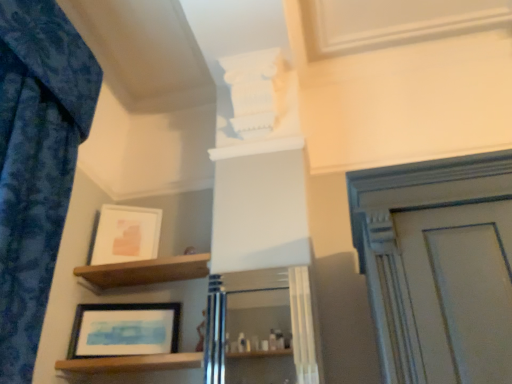
Question: Is blue fabric curtain at left bigger than matte white picture frame at upper left, which is the 1th picture frame in back-to-front order?

Choices:
 (A) yes
 (B) no

Answer: (A)

Question: Can you confirm if blue fabric curtain at left is taller than matte white picture frame at upper left, which is the 2th picture frame from bottom to top?

Choices:
 (A) no
 (B) yes

Answer: (B)

Question: From a real-world perspective, is blue fabric curtain at left on top of matte white picture frame at upper left, which is the 2th picture frame from bottom to top?

Choices:
 (A) no
 (B) yes

Answer: (A)

Question: Does blue fabric curtain at left lie in front of matte white picture frame at upper left, placed as the 1th picture frame when sorted from top to bottom?

Choices:
 (A) no
 (B) yes

Answer: (B)

Question: Does blue fabric curtain at left have a greater width compared to matte white picture frame at upper left, which is the 1th picture frame in back-to-front order?

Choices:
 (A) yes
 (B) no

Answer: (A)

Question: Would you say blue fabric curtain at left is to the left or to the right of matte black picture frame at lower left, the 2th picture frame viewed from the top, in the picture?

Choices:
 (A) left
 (B) right

Answer: (A)

Question: Is point (20, 157) closer or farther from the camera than point (155, 322)?

Choices:
 (A) closer
 (B) farther

Answer: (A)

Question: From the image's perspective, is blue fabric curtain at left located above or below matte black picture frame at lower left, the 2th picture frame viewed from the top?

Choices:
 (A) below
 (B) above

Answer: (B)

Question: Looking at their shapes, would you say blue fabric curtain at left is wider or thinner than matte black picture frame at lower left, acting as the second picture frame starting from the back?

Choices:
 (A) thin
 (B) wide

Answer: (B)

Question: From the image's perspective, relative to matte white picture frame at upper left, the second picture frame when ordered from front to back, is matte black picture frame at lower left, the first picture frame viewed from the front, above or below?

Choices:
 (A) below
 (B) above

Answer: (A)

Question: From a real-world perspective, is matte black picture frame at lower left, acting as the second picture frame starting from the back, positioned above or below matte white picture frame at upper left, the second picture frame when ordered from front to back?

Choices:
 (A) above
 (B) below

Answer: (B)

Question: Is point (78, 309) closer or farther from the camera than point (137, 246)?

Choices:
 (A) closer
 (B) farther

Answer: (A)

Question: Based on their sizes in the image, would you say matte black picture frame at lower left, acting as the second picture frame starting from the back, is bigger or smaller than matte white picture frame at upper left, which is the 1th picture frame in back-to-front order?

Choices:
 (A) small
 (B) big

Answer: (B)

Question: In terms of width, does matte white picture frame at upper left, which is the 1th picture frame in back-to-front order, look wider or thinner when compared to wooden at lower left, which is counted as the 2th shelf, starting from the top?

Choices:
 (A) wide
 (B) thin

Answer: (B)

Question: Is matte white picture frame at upper left, which is the 1th picture frame in back-to-front order, bigger or smaller than wooden at lower left, which is counted as the 2th shelf, starting from the top?

Choices:
 (A) big
 (B) small

Answer: (B)